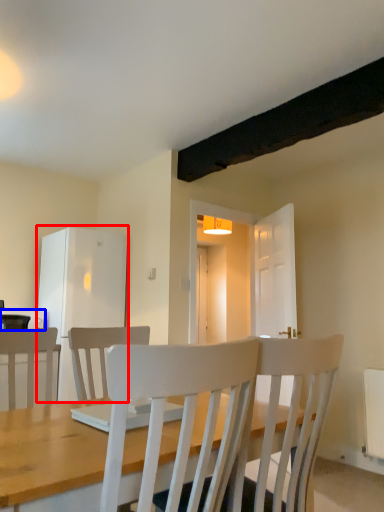
Question: Among these objects, which one is nearest to the camera, fridge (highlighted by a red box) or appliance (highlighted by a blue box)?

Choices:
 (A) fridge
 (B) appliance

Answer: (B)